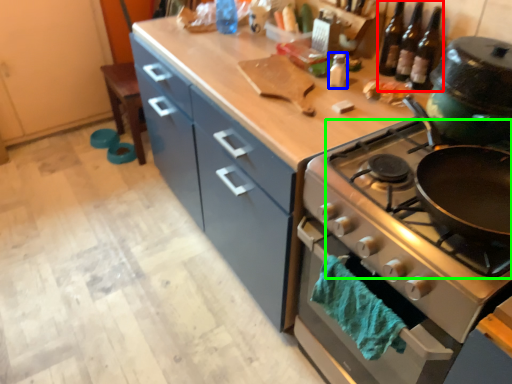
Question: Which object is the closest to the wine bottle (highlighted by a red box)? Choose among these: bottle (highlighted by a blue box) or gas stove (highlighted by a green box).

Choices:
 (A) bottle
 (B) gas stove

Answer: (A)